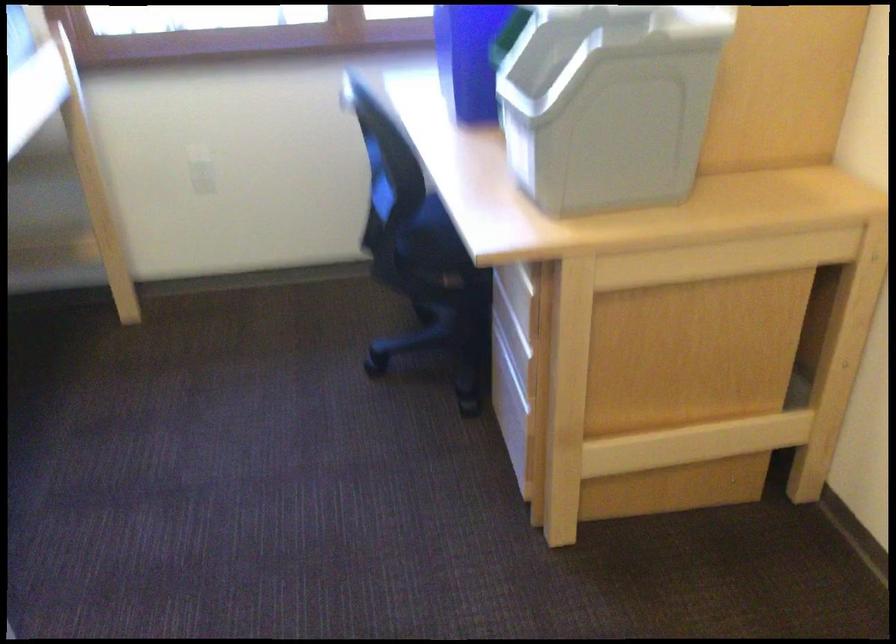
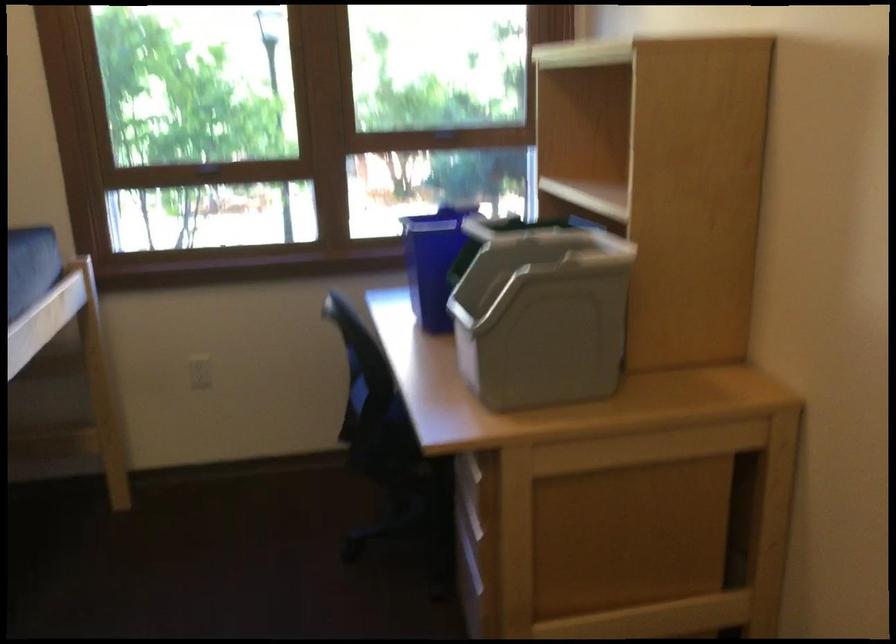
What movement of the cameraman would produce the second image?

The cameraman moved toward right, backward.